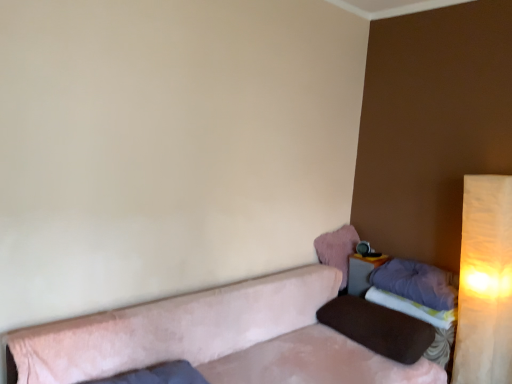
Question: Is purple soft pillow at right, arranged as the second pillow when ordered from the bottom, surrounding warm beige fabric lampshade at right?

Choices:
 (A) yes
 (B) no

Answer: (B)

Question: Is purple soft pillow at right, the 2th pillow from the top, turned away from warm beige fabric lampshade at right?

Choices:
 (A) yes
 (B) no

Answer: (B)

Question: Considering the relative sizes of purple soft pillow at right, the 2th pillow from the top, and warm beige fabric lampshade at right in the image provided, is purple soft pillow at right, the 2th pillow from the top, bigger than warm beige fabric lampshade at right?

Choices:
 (A) no
 (B) yes

Answer: (A)

Question: From the image's perspective, is purple soft pillow at right, arranged as the second pillow when ordered from the bottom, under warm beige fabric lampshade at right?

Choices:
 (A) yes
 (B) no

Answer: (A)

Question: Considering the relative positions of purple soft pillow at right, the 2th pillow from the top, and warm beige fabric lampshade at right in the image provided, is purple soft pillow at right, the 2th pillow from the top, to the right of warm beige fabric lampshade at right from the viewer's perspective?

Choices:
 (A) yes
 (B) no

Answer: (B)

Question: Considering their positions, is brown fabric pillow at right, which appears as the third pillow when viewed from the top, located in front of or behind suede-like beige couch at lower right?

Choices:
 (A) front
 (B) behind

Answer: (B)

Question: In terms of size, does brown fabric pillow at right, arranged as the first pillow when ordered from the bottom, appear bigger or smaller than suede-like beige couch at lower right?

Choices:
 (A) small
 (B) big

Answer: (A)

Question: Choose the correct answer: Is brown fabric pillow at right, arranged as the first pillow when ordered from the bottom, inside suede-like beige couch at lower right or outside it?

Choices:
 (A) outside
 (B) inside

Answer: (B)

Question: From a real-world perspective, is brown fabric pillow at right, arranged as the first pillow when ordered from the bottom, positioned above or below suede-like beige couch at lower right?

Choices:
 (A) below
 (B) above

Answer: (B)

Question: Is warm beige fabric lampshade at right bigger or smaller than purple soft pillow at right, arranged as the second pillow when ordered from the bottom?

Choices:
 (A) small
 (B) big

Answer: (B)

Question: From the image's perspective, is warm beige fabric lampshade at right above or below purple soft pillow at right, arranged as the second pillow when ordered from the bottom?

Choices:
 (A) below
 (B) above

Answer: (B)

Question: In the image, is warm beige fabric lampshade at right positioned in front of or behind purple soft pillow at right, the 2th pillow from the top?

Choices:
 (A) behind
 (B) front

Answer: (B)

Question: From their relative heights in the image, would you say warm beige fabric lampshade at right is taller or shorter than purple soft pillow at right, arranged as the second pillow when ordered from the bottom?

Choices:
 (A) short
 (B) tall

Answer: (B)

Question: From their relative heights in the image, would you say suede-like beige couch at lower right is taller or shorter than warm beige fabric lampshade at right?

Choices:
 (A) tall
 (B) short

Answer: (B)

Question: In the image, is suede-like beige couch at lower right positioned in front of or behind warm beige fabric lampshade at right?

Choices:
 (A) front
 (B) behind

Answer: (A)